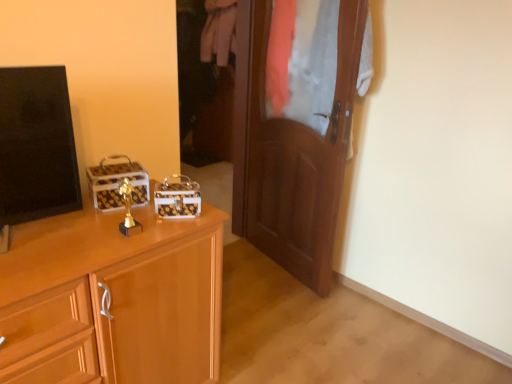
Where is `white cotton pants at center`? The height and width of the screenshot is (384, 512). white cotton pants at center is located at coordinates pyautogui.click(x=218, y=31).

This screenshot has height=384, width=512. I want to click on white cotton pants at center, so 218,31.

Is black glossy tv at left inside wooden door at center?

No, wooden door at center does not contain black glossy tv at left.

Is wooden door at center directly adjacent to black glossy tv at left?

No, wooden door at center is not next to black glossy tv at left.

In terms of size, does wooden door at center appear bigger or smaller than black glossy tv at left?

wooden door at center is bigger than black glossy tv at left.

The image size is (512, 384). Identify the location of tv show below the wooden door at center (from the image's perspective). (35, 147).

Is point (137, 246) more distant than point (218, 31)?

No.

From the image's perspective, is matte wood cabinet at left located beneath white cotton pants at center?

Correct, matte wood cabinet at left appears lower than white cotton pants at center in the image.

Considering the relative positions of matte wood cabinet at left and white cotton pants at center in the image provided, is matte wood cabinet at left to the left of white cotton pants at center from the viewer's perspective?

Yes, matte wood cabinet at left is to the left of white cotton pants at center.

Can you confirm if white cotton pants at center is positioned to the left of matte wood cabinet at left?

No.

From the image's perspective, between white cotton pants at center and matte wood cabinet at left, who is located below?

matte wood cabinet at left is shown below in the image.

Is point (229, 28) positioned before point (32, 347)?

No, it is behind (32, 347).

Is white cotton pants at center wider or thinner than matte wood cabinet at left?

Clearly, white cotton pants at center has less width compared to matte wood cabinet at left.

Could wooden door at center be considered to be inside white cotton pants at center?

No.

From a real-world perspective, is white cotton pants at center positioned over wooden door at center based on gravity?

Yes, from a real-world perspective, white cotton pants at center is above wooden door at center.

How many degrees apart are the facing directions of white cotton pants at center and wooden door at center?

They differ by 10.2 degrees in their facing directions.

Looking at their sizes, would you say white cotton pants at center is wider or thinner than wooden door at center?

Considering their sizes, white cotton pants at center looks broader than wooden door at center.

From a real-world perspective, between black glossy tv at left and matte wood cabinet at left, who is vertically lower?

matte wood cabinet at left.

The height and width of the screenshot is (384, 512). I want to click on tv show behind the matte wood cabinet at left, so click(x=35, y=147).

Is black glossy tv at left oriented towards matte wood cabinet at left?

No, black glossy tv at left is not turned towards matte wood cabinet at left.

Looking at this image, considering the positions of objects black glossy tv at left and matte wood cabinet at left in the image provided, who is more to the left, black glossy tv at left or matte wood cabinet at left?

From the viewer's perspective, black glossy tv at left appears more on the left side.

Does wooden door at center have a lesser height compared to white cotton pants at center?

In fact, wooden door at center may be taller than white cotton pants at center.

Is wooden door at center at the right side of white cotton pants at center?

Yes, wooden door at center is to the right of white cotton pants at center.

From the image's perspective, is wooden door at center located above or below white cotton pants at center?

wooden door at center is situated lower than white cotton pants at center in the image.

Does point (269, 20) lie behind point (216, 7)?

No, it is not.

Is black glossy tv at left completely or partially inside white cotton pants at center?

No, white cotton pants at center does not contain black glossy tv at left.

How distant is white cotton pants at center from black glossy tv at left?

white cotton pants at center is 10.03 feet away from black glossy tv at left.

From the image's perspective, between white cotton pants at center and black glossy tv at left, which one is located above?

white cotton pants at center is shown above in the image.

Does white cotton pants at center come in front of black glossy tv at left?

No, white cotton pants at center is behind black glossy tv at left.

Find the location of a particular element. The image size is (512, 384). tv show in front of the wooden door at center is located at coordinates (35, 147).

I want to click on cabinetry below the white cotton pants at center (from the image's perspective), so click(x=112, y=300).

Based on their spatial positions, is wooden door at center or white cotton pants at center further from matte wood cabinet at left?

white cotton pants at center.

Which object lies further to the anchor point wooden door at center, matte wood cabinet at left or white cotton pants at center?

white cotton pants at center is further to wooden door at center.

Based on their spatial positions, is white cotton pants at center or black glossy tv at left closer to wooden door at center?

black glossy tv at left is closer to wooden door at center.

Looking at the image, which one is located further to matte wood cabinet at left, black glossy tv at left or wooden door at center?

wooden door at center lies further to matte wood cabinet at left than the other object.

Which object lies further to the anchor point black glossy tv at left, white cotton pants at center or matte wood cabinet at left?

Based on the image, white cotton pants at center appears to be further to black glossy tv at left.

Based on their spatial positions, is wooden door at center or matte wood cabinet at left further from white cotton pants at center?

Among the two, matte wood cabinet at left is located further to white cotton pants at center.

When comparing their distances from matte wood cabinet at left, does black glossy tv at left or white cotton pants at center seem closer?

black glossy tv at left lies closer to matte wood cabinet at left than the other object.

When comparing their distances from black glossy tv at left, does matte wood cabinet at left or wooden door at center seem further?

Among the two, wooden door at center is located further to black glossy tv at left.

Identify the location of door between matte wood cabinet at left and white cotton pants at center from front to back. The width and height of the screenshot is (512, 384). (291, 153).

Locate an element on the screen. door between black glossy tv at left and white cotton pants at center in the front-back direction is located at coordinates (291, 153).

Find the location of a particular element. The height and width of the screenshot is (384, 512). tv show between matte wood cabinet at left and white cotton pants at center in the front-back direction is located at coordinates (35, 147).

The image size is (512, 384). In order to click on tv show between matte wood cabinet at left and wooden door at center along the z-axis in this screenshot , I will do `click(35, 147)`.